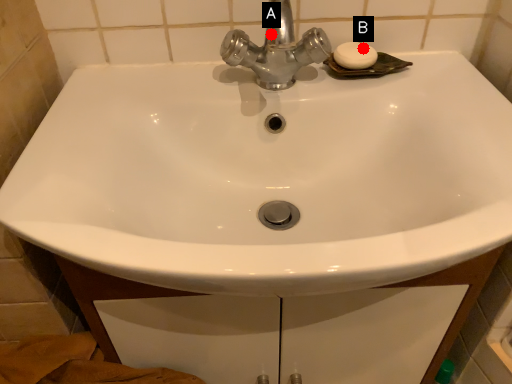
Question: Two points are circled on the image, labeled by A and B beside each circle. Which point is closer to the camera taking this photo?

Choices:
 (A) A is closer
 (B) B is closer

Answer: (A)